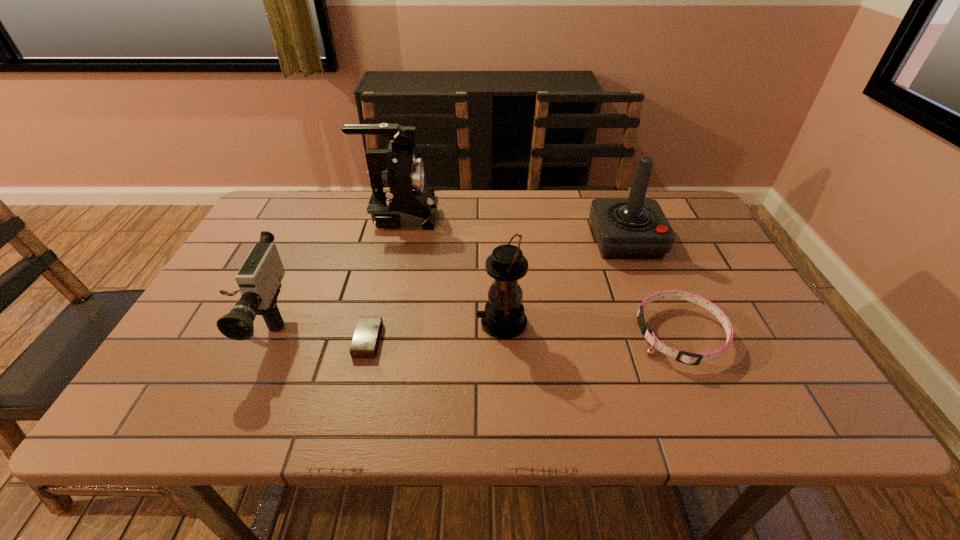
Image resolution: width=960 pixels, height=540 pixels. Identify the location of object that is at the left edge. (259, 279).

Where is `joystick that is at the right edge`? The height and width of the screenshot is (540, 960). joystick that is at the right edge is located at coordinates (635, 228).

I want to click on dog collar at the right edge, so click(695, 358).

I want to click on object situated at the far right corner, so click(x=635, y=228).

Where is `blank space at the far edge of the desktop`? blank space at the far edge of the desktop is located at coordinates (579, 212).

This screenshot has height=540, width=960. In order to click on vacant space at the near edge of the desktop in this screenshot , I will do `click(731, 420)`.

In the image, there is a desktop. Identify the location of vacant space at the left edge. The height and width of the screenshot is (540, 960). (221, 334).

At what (x,y) coordinates should I click in order to perform the action: click on vacant space at the right edge of the desktop. Please return your answer as a coordinate pair (x, y). This screenshot has height=540, width=960. Looking at the image, I should click on (733, 323).

The image size is (960, 540). Find the location of `free space at the far left corner of the desktop`. free space at the far left corner of the desktop is located at coordinates (250, 234).

This screenshot has height=540, width=960. Identify the location of blank area at the far right corner. (667, 205).